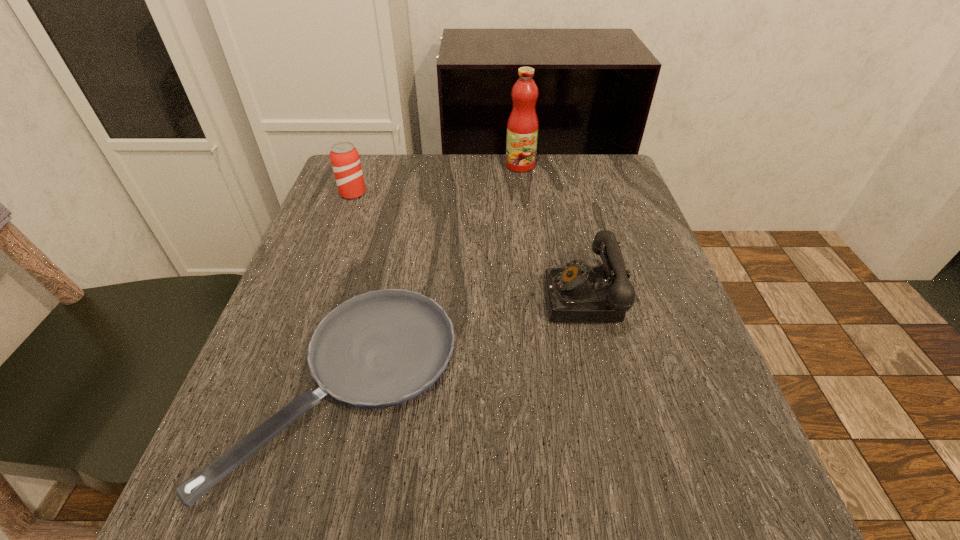
This screenshot has width=960, height=540. I want to click on free space located 0.290m on the right of the shortest object, so click(639, 387).

I want to click on fruit juice present at the far edge, so click(x=522, y=128).

You are a GUI agent. You are given a task and a screenshot of the screen. Output one action in this format:
    pyautogui.click(x=<x>, y=<y>)
    Task: Click on the beer can that is positioned at the far edge
    
    Given the screenshot: What is the action you would take?
    pyautogui.click(x=344, y=157)

Find the location of a particular element. This screenshot has height=540, width=960. object located in the near edge section of the desktop is located at coordinates (381, 348).

The image size is (960, 540). Find the location of `beer can at the left edge`. beer can at the left edge is located at coordinates (344, 157).

Identify the location of frying pan that is at the left edge. (381, 348).

The height and width of the screenshot is (540, 960). I want to click on object that is at the right edge, so click(576, 293).

Identify the location of object that is at the far left corner. (344, 157).

Find the location of a particular element. This screenshot has height=540, width=960. object located in the near left corner section of the desktop is located at coordinates (381, 348).

You are a GUI agent. You are given a task and a screenshot of the screen. Output one action in this format:
    pyautogui.click(x=<x>, y=<y>)
    Task: Click on the free region at the far edge of the desktop
    The height and width of the screenshot is (540, 960).
    Given the screenshot: What is the action you would take?
    pyautogui.click(x=500, y=184)